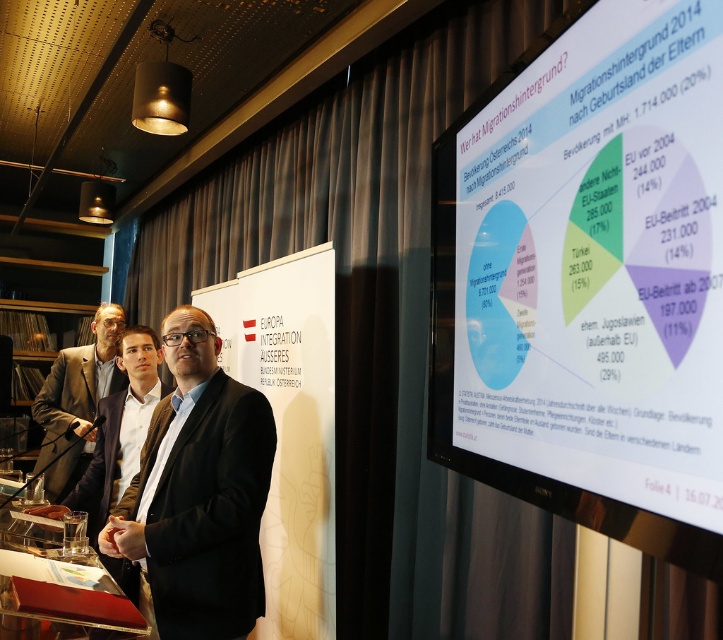
Who is positioned more to the left, black matte suit at center or dark brown suit at center?

Positioned to the left is dark brown suit at center.

Can you confirm if black matte suit at center is positioned below dark brown suit at center?

No.

Is point (194, 582) closer to camera compared to point (129, 332)?

Yes, point (194, 582) is in front of point (129, 332).

Find the location of `black matte suit at center`. black matte suit at center is located at coordinates (210, 515).

Between point (247, 624) and point (61, 371), which one is positioned behind?

The point (61, 371) is behind.

Does black matte suit at center appear under matte black suit at left?

Indeed, black matte suit at center is positioned under matte black suit at left.

Is point (235, 624) behind point (114, 339)?

No, (235, 624) is in front of (114, 339).

You are a GUI agent. You are given a task and a screenshot of the screen. Output one action in this format:
    pyautogui.click(x=<x>, y=<y>)
    Task: Click on the black matte suit at center
    The width and height of the screenshot is (723, 640).
    Given the screenshot: What is the action you would take?
    pyautogui.click(x=210, y=515)

Can you confirm if white glossy projection screen at upper right is thinner than matte black suit at left?

Correct, white glossy projection screen at upper right's width is less than matte black suit at left's.

Is point (603, 10) in front of point (59, 470)?

Yes, it is in front of point (59, 470).

Find the location of `white glossy projection screen at upper right`. white glossy projection screen at upper right is located at coordinates (589, 280).

The width and height of the screenshot is (723, 640). I want to click on white glossy projection screen at upper right, so click(589, 280).